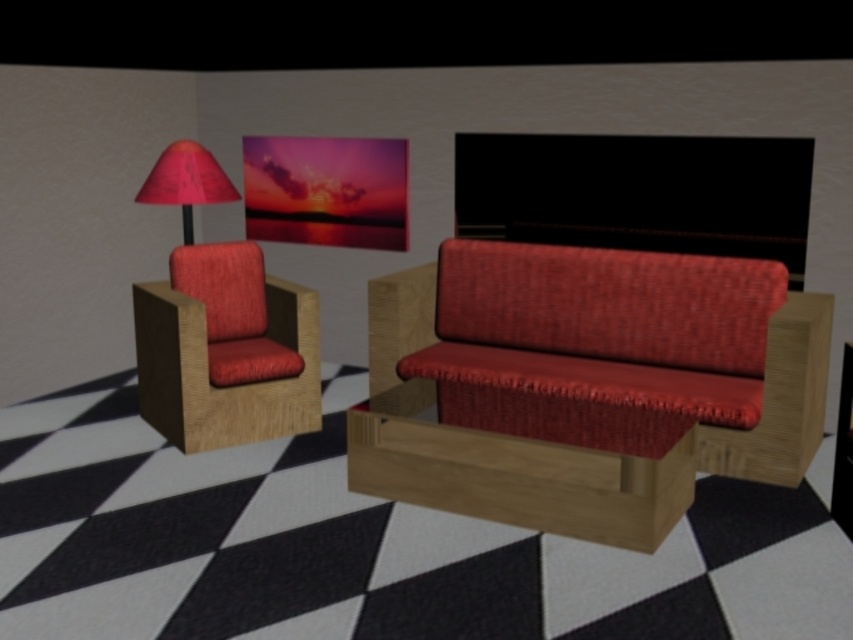
Is matte red fabric couch at center taller than matte red lampshade at upper left?

Correct, matte red fabric couch at center is much taller as matte red lampshade at upper left.

Between matte red fabric couch at center and matte red lampshade at upper left, which one is positioned lower?

matte red fabric couch at center is lower down.

Is point (374, 300) positioned after point (148, 182)?

No.

This screenshot has height=640, width=853. I want to click on matte red fabric couch at center, so click(x=585, y=385).

Between point (456, 492) and point (310, 426), which one is positioned in front?

Point (456, 492)

Is matte red fabric couch at center smaller than matte wood armchair at left?

Actually, matte red fabric couch at center might be larger than matte wood armchair at left.

This screenshot has height=640, width=853. I want to click on matte red fabric couch at center, so click(585, 385).

Does matte wood armchair at left have a larger size compared to matte red lampshade at upper left?

Yes, matte wood armchair at left is bigger than matte red lampshade at upper left.

Which of these two, matte wood armchair at left or matte red lampshade at upper left, stands shorter?

With less height is matte red lampshade at upper left.

Is point (300, 296) positioned behind point (180, 192)?

No, it is not.

I want to click on matte wood armchair at left, so click(225, 349).